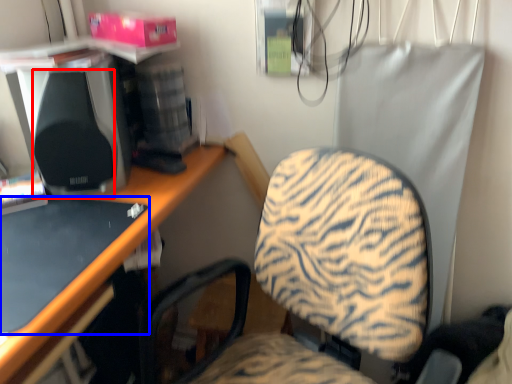
Question: Which object appears farthest to the camera in this image, speaker (highlighted by a red box) or desktop (highlighted by a blue box)?

Choices:
 (A) speaker
 (B) desktop

Answer: (A)